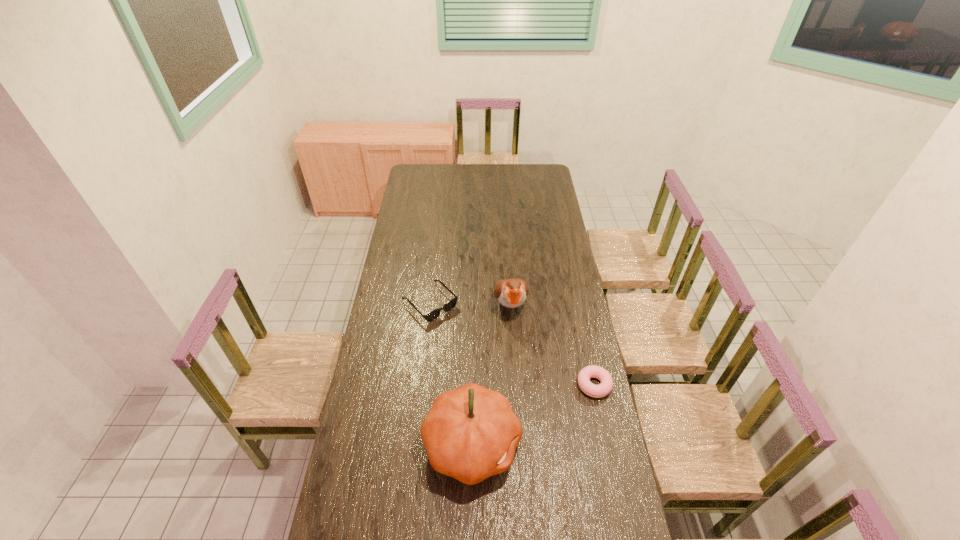
Locate which object ranks second in proximity to the bird. Please provide its 2D coordinates. Your answer should be formatted as a tuple, i.e. [(x, y)], where the tuple contains the x and y coordinates of a point satisfying the conditions above.

[(605, 387)]

Choose which object is the nearest neighbor to the second nearest object. Please provide its 2D coordinates. Your answer should be formatted as a tuple, i.e. [(x, y)], where the tuple contains the x and y coordinates of a point satisfying the conditions above.

[(471, 433)]

Locate an element on the screen. The width and height of the screenshot is (960, 540). free space that satisfies the following two spatial constraints: 1. on the front side of the pumpkin; 2. on the front face of the sunglasses is located at coordinates (415, 444).